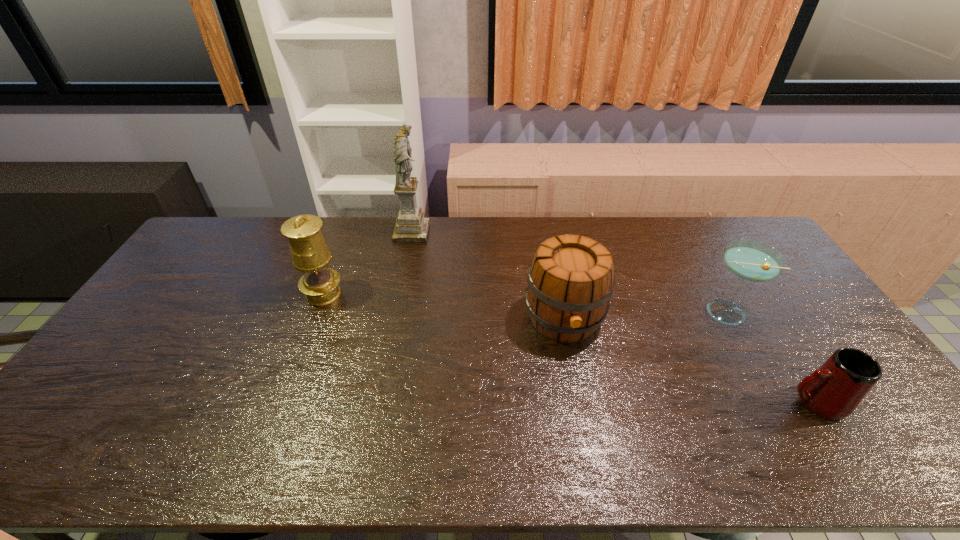
Image resolution: width=960 pixels, height=540 pixels. I want to click on blank space located 0.300m on the side of the third object from right to left where the spigot is located, so click(590, 457).

Find the location of a particular element. This screenshot has width=960, height=540. vacant space located on the left of the martini is located at coordinates (612, 312).

Where is `vacant space located on the side of the nearest object with the handle`? The height and width of the screenshot is (540, 960). vacant space located on the side of the nearest object with the handle is located at coordinates (695, 402).

Identify the location of vacant space located on the side of the nearest object with the handle. (704, 402).

Locate an element on the screen. The height and width of the screenshot is (540, 960). vacant region located on the side of the nearest object with the handle is located at coordinates (687, 402).

Where is `object at the far edge`? object at the far edge is located at coordinates (411, 226).

Identify the location of object that is at the right edge. (834, 391).

You are a GUI agent. You are given a task and a screenshot of the screen. Output one action in this format:
    pyautogui.click(x=<x>, y=<y>)
    Task: Click on the free spot at the far edge of the desktop
    
    Given the screenshot: What is the action you would take?
    pyautogui.click(x=252, y=234)

The image size is (960, 540). I want to click on free location at the near edge, so click(681, 465).

At what (x,y) coordinates should I click in order to perform the action: click on vacant space at the right edge of the desktop. Please return your answer as a coordinate pair (x, y). The height and width of the screenshot is (540, 960). Looking at the image, I should click on (846, 418).